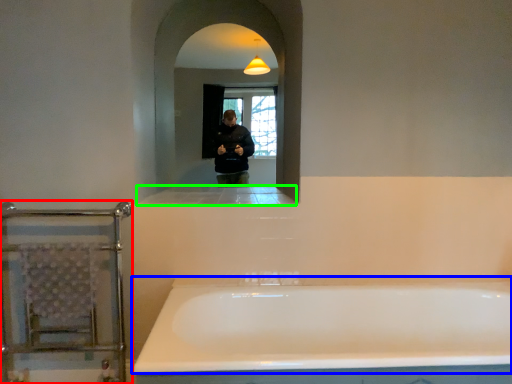
Question: Considering the real-world distances, which object is farthest from balustrade (highlighted by a red box)? bathtub (highlighted by a blue box) or ledge (highlighted by a green box)?

Choices:
 (A) bathtub
 (B) ledge

Answer: (A)